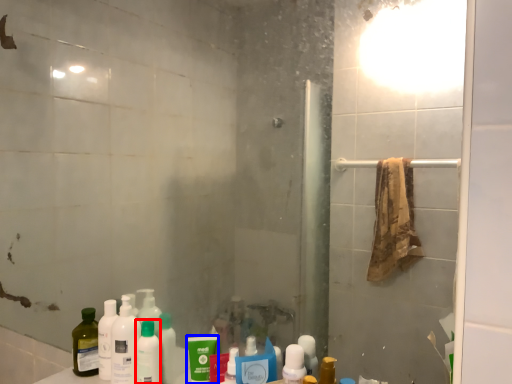
Question: Among these objects, which one is nearest to the camera, toiletry (highlighted by a red box) or mouthwash (highlighted by a blue box)?

Choices:
 (A) toiletry
 (B) mouthwash

Answer: (B)